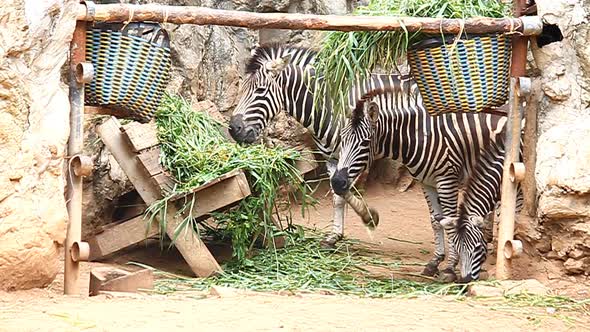
At what (x,y) coordinates should I click in order to perform the action: click on basket. Please return your answer as a coordinate pair (x, y). This screenshot has width=590, height=332. Looking at the image, I should click on (464, 82).